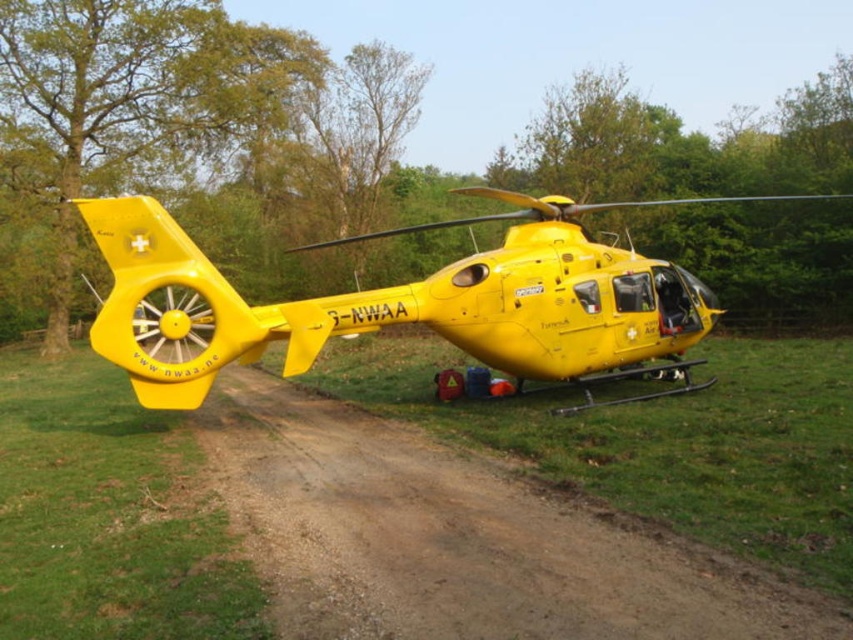
Question: Is brown dirt track at center above yellow matte helicopter at center?

Choices:
 (A) no
 (B) yes

Answer: (A)

Question: Can you confirm if brown dirt track at center is thinner than yellow matte helicopter at center?

Choices:
 (A) no
 (B) yes

Answer: (B)

Question: Can you confirm if brown dirt track at center is smaller than yellow matte helicopter at center?

Choices:
 (A) yes
 (B) no

Answer: (A)